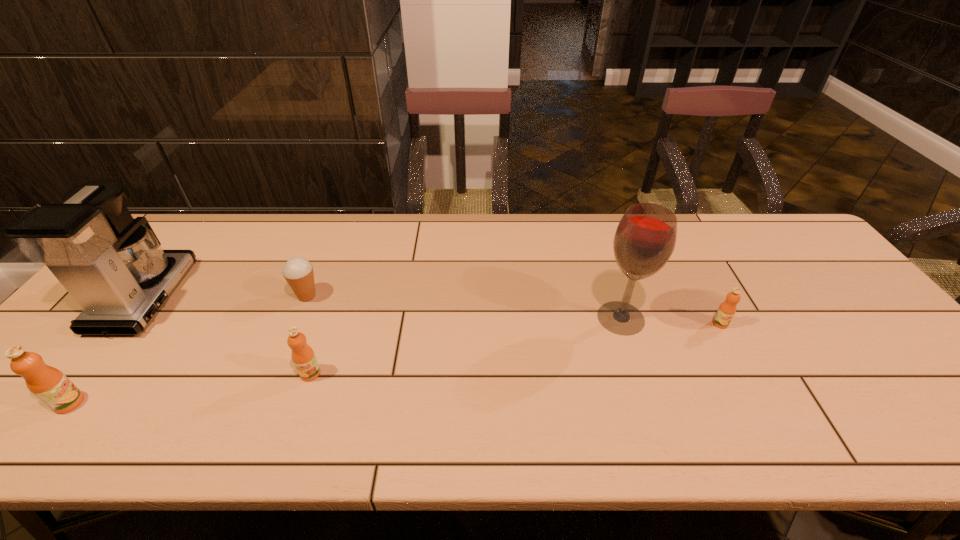
To make them evenly spaced by inserting another orange_juice among them, please locate a vacant spot for this new orange_juice. Please provide its 2D coordinates. Your answer should be formatted as a tuple, i.e. [(x, y)], where the tuple contains the x and y coordinates of a point satisfying the conditions above.

[(526, 347)]